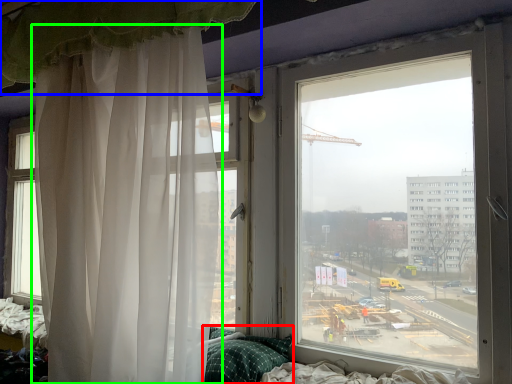
Question: Based on their relative distances, which object is farther from pillow (highlighted by a red box)? Choose from curtain (highlighted by a blue box) and curtain (highlighted by a green box).

Choices:
 (A) curtain
 (B) curtain

Answer: (A)